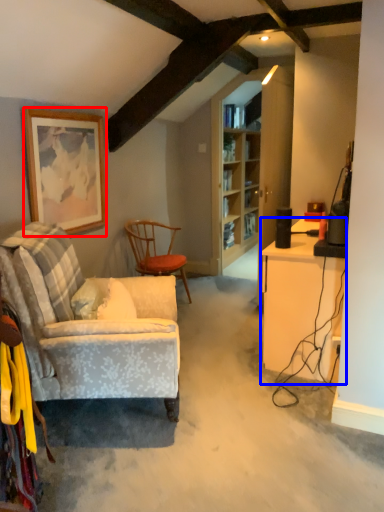
Question: Among these objects, which one is nearest to the camera, picture frame (highlighted by a red box) or desk (highlighted by a blue box)?

Choices:
 (A) picture frame
 (B) desk

Answer: (B)